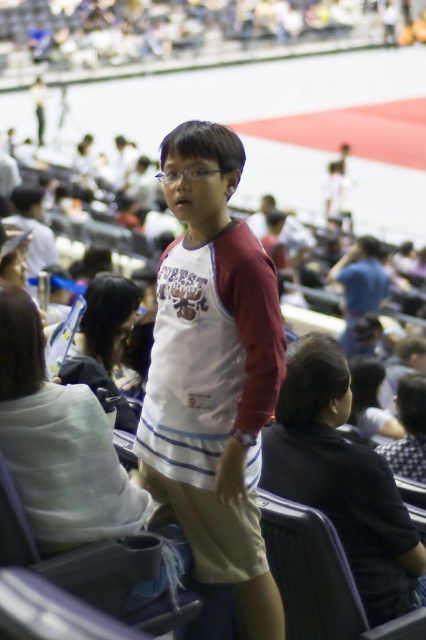
From the picture: You are a photographer trying to capture a photo of the checkered fabric headscarf at center and the black fabric shirt at center. Which one is located to the left of the other?

The black fabric shirt at center is positioned on the left side of checkered fabric headscarf at center.

You are a photographer positioned at the center of the arena. You need to capture a photo of the white cotton shirt at center. Based on the coordinates provided, where should you aim your camera?

The white cotton shirt at center is located at coordinates point (213, 372), so you should aim your camera towards that specific coordinate to capture the shirt.